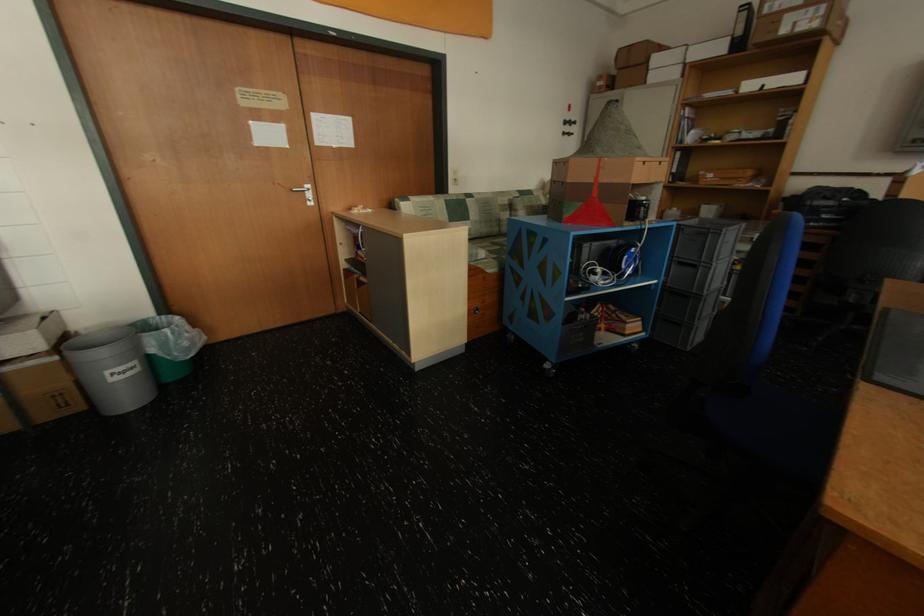
Image resolution: width=924 pixels, height=616 pixels. Identify the location of silver door handle. (306, 193).